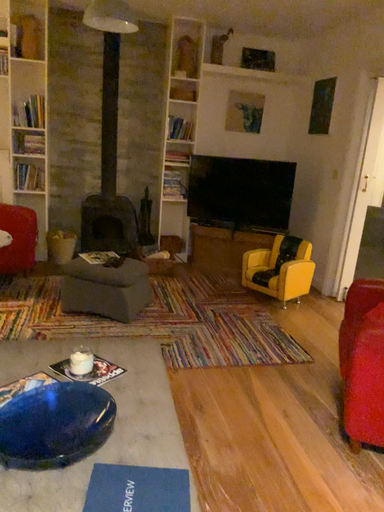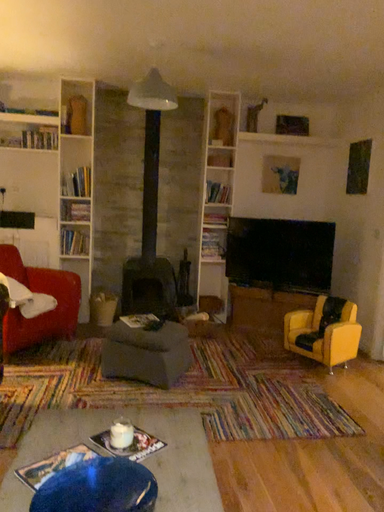
Question: How did the camera likely rotate when shooting the video?

Choices:
 (A) rotated downward
 (B) rotated upward

Answer: (B)